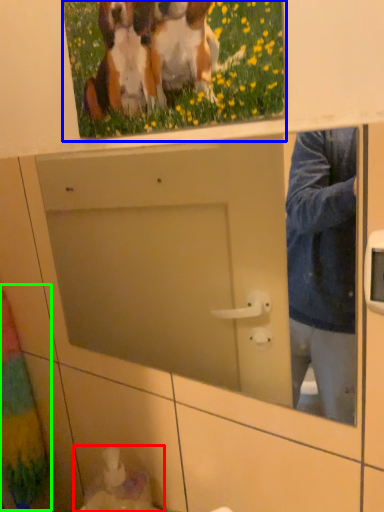
Question: Based on their relative distances, which object is farther from sink (highlighted by a red box)? Choose from picture frame (highlighted by a blue box) and curtain (highlighted by a green box).

Choices:
 (A) picture frame
 (B) curtain

Answer: (A)